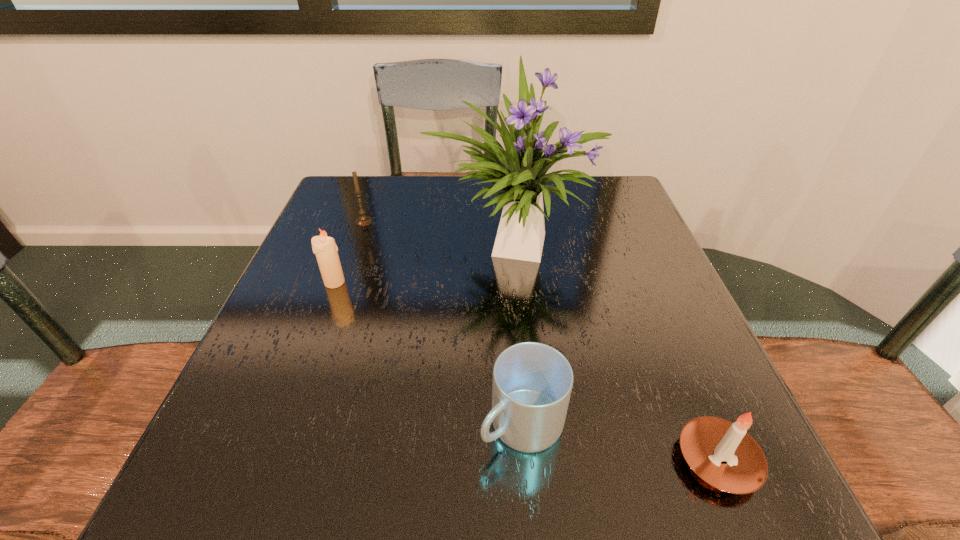
Find the location of `the tallest object`. the tallest object is located at coordinates coord(520,172).

Locate an element on the screen. The width and height of the screenshot is (960, 540). the farthest candle is located at coordinates (364, 220).

Identify the location of the second nearest candle. The image size is (960, 540). (324, 247).

The image size is (960, 540). In order to click on mug in this screenshot , I will do `click(532, 382)`.

Where is `the rightmost candle`? Image resolution: width=960 pixels, height=540 pixels. the rightmost candle is located at coordinates (722, 453).

In order to click on the rightmost object in this screenshot , I will do `click(722, 453)`.

Where is `vacant space located on the front of the flower arrangement`? This screenshot has height=540, width=960. vacant space located on the front of the flower arrangement is located at coordinates (523, 362).

I want to click on vacant space situated 0.270m on the front of the farthest candle, so click(x=334, y=306).

At what (x,y) coordinates should I click in order to perform the action: click on free space located on the back of the second farthest candle. Please return your answer as a coordinate pair (x, y). This screenshot has height=540, width=960. Looking at the image, I should click on (358, 219).

Where is `blank space located on the back of the mug`? The height and width of the screenshot is (540, 960). blank space located on the back of the mug is located at coordinates (516, 339).